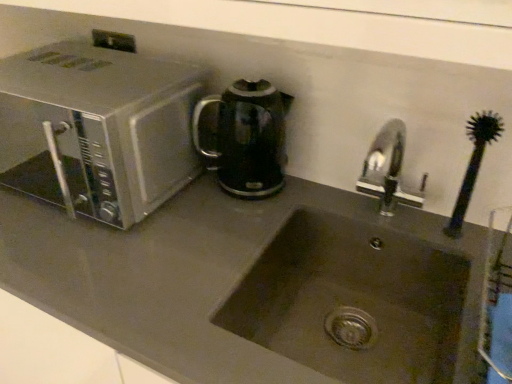
Locate an element on the screen. free location above silver metallic microwave at left (from a real-world perspective) is located at coordinates (67, 79).